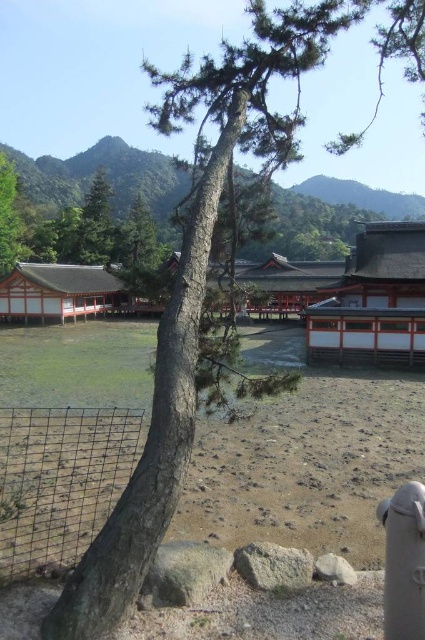
You are a visitor at a botanical garden and see the black wire mesh at center and the green leafy tree at left. Which object is shorter?

The black wire mesh at center is not as tall as the green leafy tree at left, so the black wire mesh at center is shorter.

You are standing in the serene landscape and want to walk from the brown sandy dirt at center to the green matte tree at upper center. Which direction should you head towards?

The brown sandy dirt at center is to the right of the green matte tree at upper center, so you should head towards the left to reach the tree.

You are a landscape architect designing a new garden. You have a black wire mesh at center and a green leafy tree at left in your design. Considering their distance, can you place a 50 meter long pathway between them without overlapping?

The black wire mesh at center and green leafy tree at left are 47.21 meters apart. A 50 meter long pathway would be longer than the distance between them, so it can be placed between them without overlapping as the pathway can extend beyond the two objects.